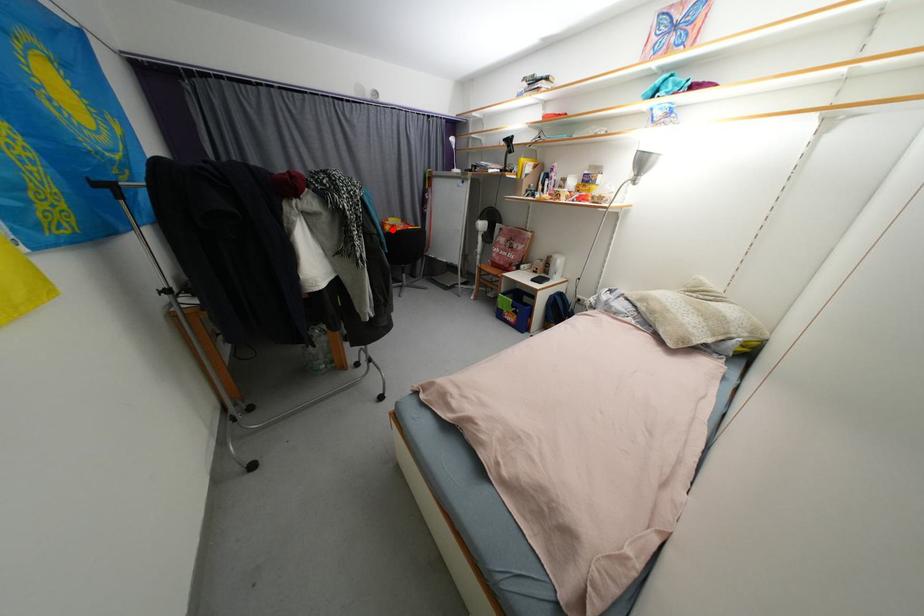
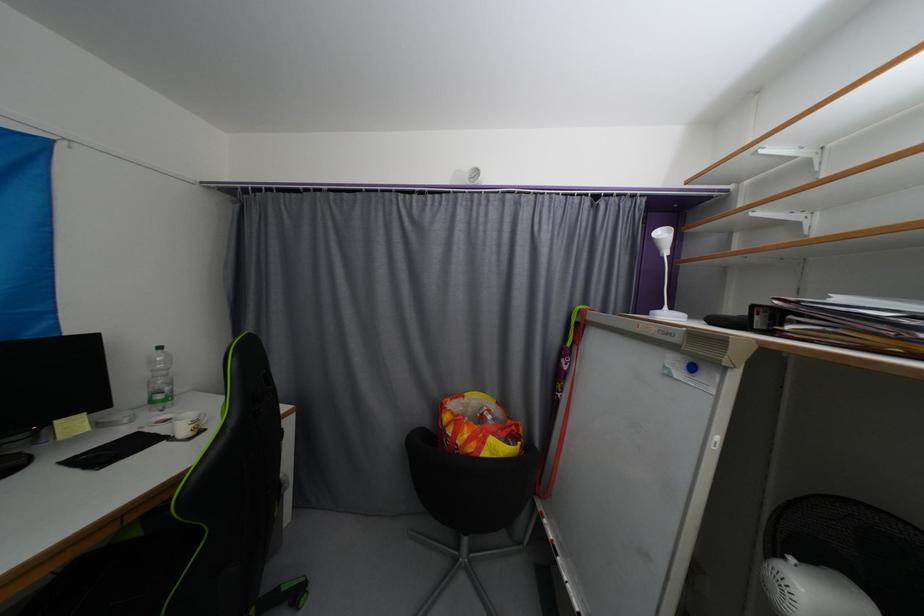
Question: A red point is marked in image1. In image2, is the corresponding 3D point closer to the camera or farther? Reply with the corresponding letter.

Choices:
 (A) The corresponding 3D point is closer.
 (B) The corresponding 3D point is farther.

Answer: (B)